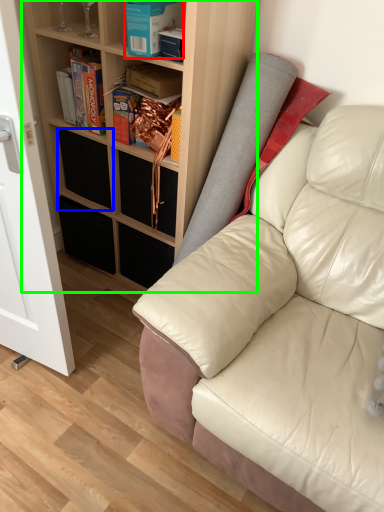
Question: Which object is the closest to the book (highlighted by a red box)? Choose among these: drawer (highlighted by a blue box) or shelf (highlighted by a green box).

Choices:
 (A) drawer
 (B) shelf

Answer: (B)